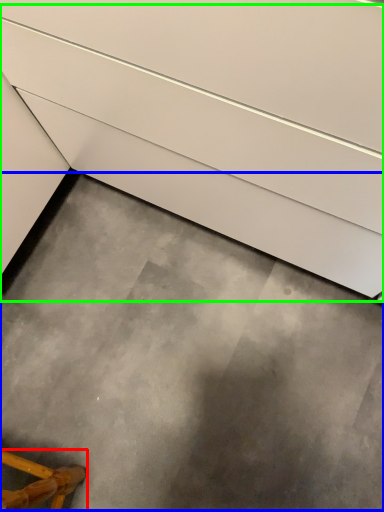
Question: Estimate the real-world distances between objects in this image. Which object is farther from furniture (highlighted by a red box), concrete (highlighted by a blue box) or stairs (highlighted by a green box)?

Choices:
 (A) concrete
 (B) stairs

Answer: (B)